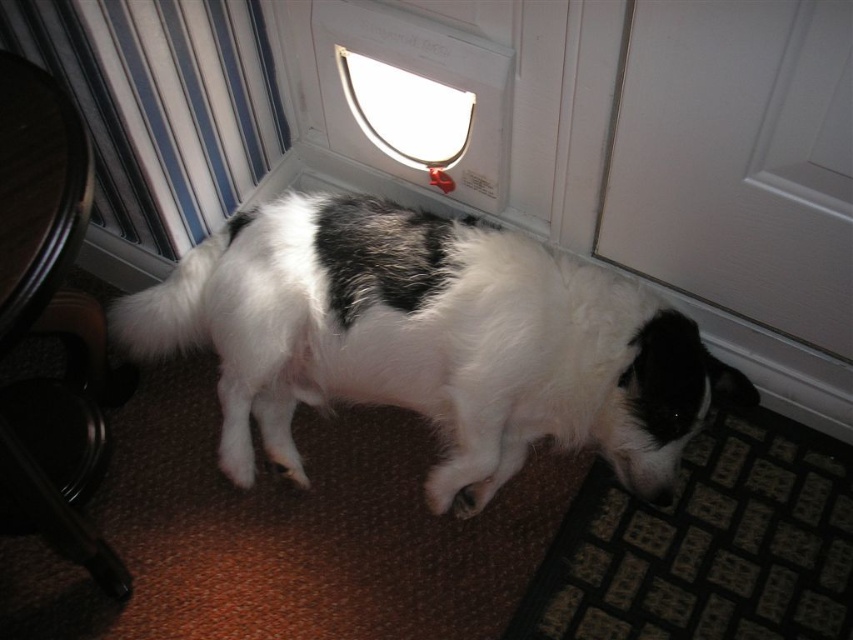
Question: Which of the following is the farthest from the observer?

Choices:
 (A) (410, 163)
 (B) (808, 179)

Answer: (A)

Question: Estimate the real-world distances between objects in this image. Which object is closer to the transparent plastic pet door at upper center?

Choices:
 (A) white matte door at lower right
 (B) white fluffy dog at center

Answer: (B)

Question: Does white fluffy dog at center come in front of transparent plastic pet door at upper center?

Choices:
 (A) yes
 (B) no

Answer: (A)

Question: Does white fluffy dog at center appear on the left side of white matte door at lower right?

Choices:
 (A) yes
 (B) no

Answer: (A)

Question: From the image, what is the correct spatial relationship of white fluffy dog at center in relation to transparent plastic pet door at upper center?

Choices:
 (A) left
 (B) right

Answer: (B)

Question: Which of the following is the closest to the observer?

Choices:
 (A) white matte door at lower right
 (B) transparent plastic pet door at upper center

Answer: (A)